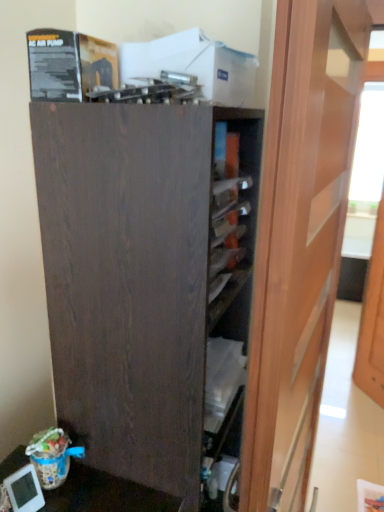
The image size is (384, 512). I want to click on free location to the left of wooden door at right, marked as the 1th door in a back-to-front arrangement, so click(345, 400).